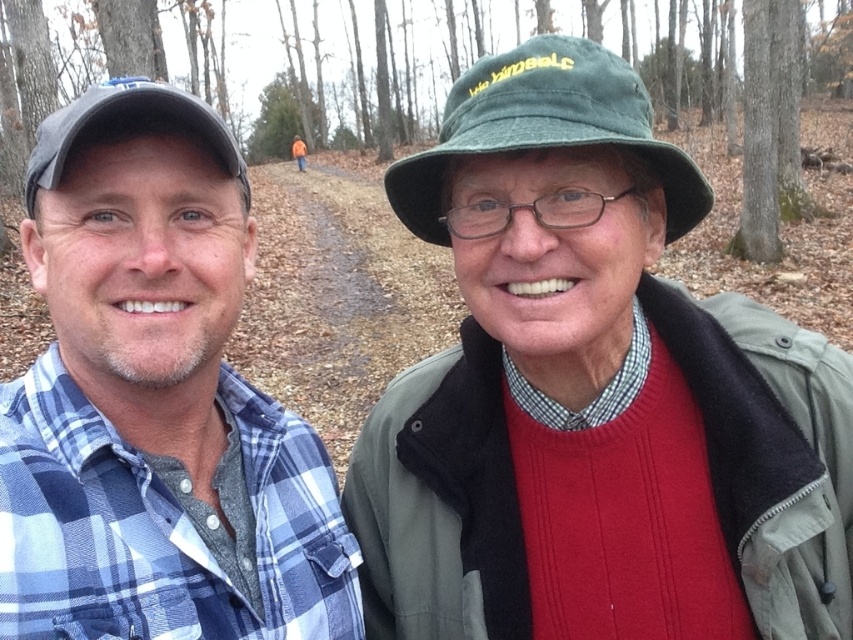
Where is `green fabric hat at center`? green fabric hat at center is located at coordinates (544, 125).

Is green fabric hat at center taller than matte gray cap at left?

Incorrect, green fabric hat at center's height is not larger of matte gray cap at left's.

Where is `green fabric hat at center`? green fabric hat at center is located at coordinates (544, 125).

Is blue plaid shirt at left thinner than matte gray cap at left?

Correct, blue plaid shirt at left's width is less than matte gray cap at left's.

Can you confirm if blue plaid shirt at left is positioned below matte gray cap at left?

Yes.

I want to click on blue plaid shirt at left, so click(x=155, y=401).

Which of these two, blue plaid shirt at left or green fabric hat at center, stands taller?

Answer: With more height is blue plaid shirt at left.

At what (x,y) coordinates should I click in order to perform the action: click on blue plaid shirt at left. Please return your answer as a coordinate pair (x, y). The height and width of the screenshot is (640, 853). Looking at the image, I should click on (155, 401).

Find the location of a particular element. This screenshot has height=640, width=853. blue plaid shirt at left is located at coordinates (155, 401).